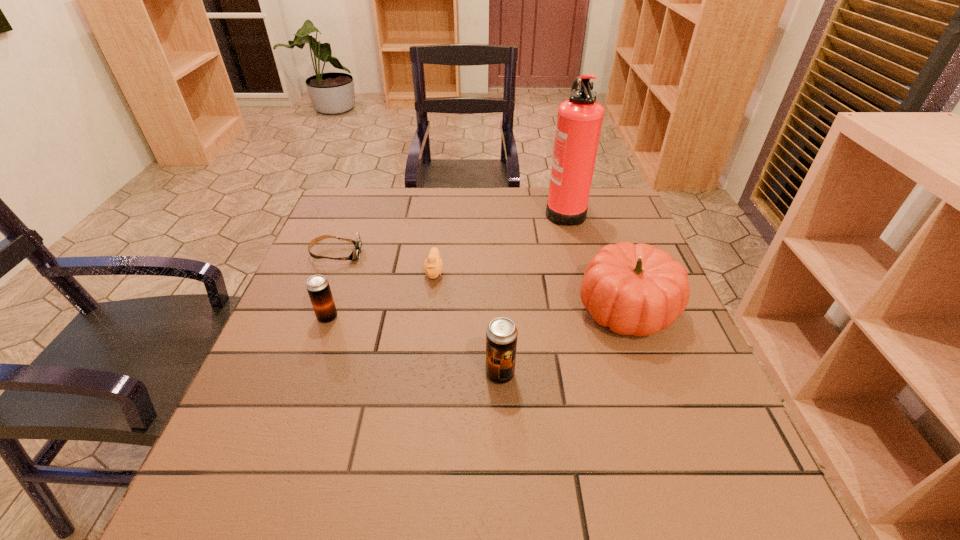
This screenshot has width=960, height=540. In order to click on vacant space situated on the back of the shorter beer can in this screenshot , I will do `click(352, 249)`.

You are a GUI agent. You are given a task and a screenshot of the screen. Output one action in this format:
    pyautogui.click(x=<x>, y=<y>)
    Task: Click on the free point located on the back of the nearer beer can
    The width and height of the screenshot is (960, 540).
    Given the screenshot: What is the action you would take?
    pyautogui.click(x=494, y=246)

Identify the location of blank space located at the nozzle of the tallest object. (444, 210).

Locate an element on the screen. The height and width of the screenshot is (540, 960). vacant space located 0.380m at the nozzle of the tallest object is located at coordinates (418, 210).

This screenshot has height=540, width=960. Find the location of `vacant space situated at the nozzle of the tallest object`. vacant space situated at the nozzle of the tallest object is located at coordinates (492, 210).

At what (x,y) coordinates should I click in order to perform the action: click on free region located 0.200m on the back of the pumpkin. Please return your answer as a coordinate pair (x, y). The image size is (960, 540). Looking at the image, I should click on (x=599, y=231).

This screenshot has width=960, height=540. Identify the location of vacant space located 0.120m on the front-facing side of the goggles. (406, 254).

What are the coordinates of `free space located 0.260m on the face of the third object from left to right` in the screenshot? It's located at (422, 371).

In order to click on object that is positioned at the far edge in this screenshot , I will do `click(579, 121)`.

Identify the location of beer can situated at the left edge. Image resolution: width=960 pixels, height=540 pixels. (318, 287).